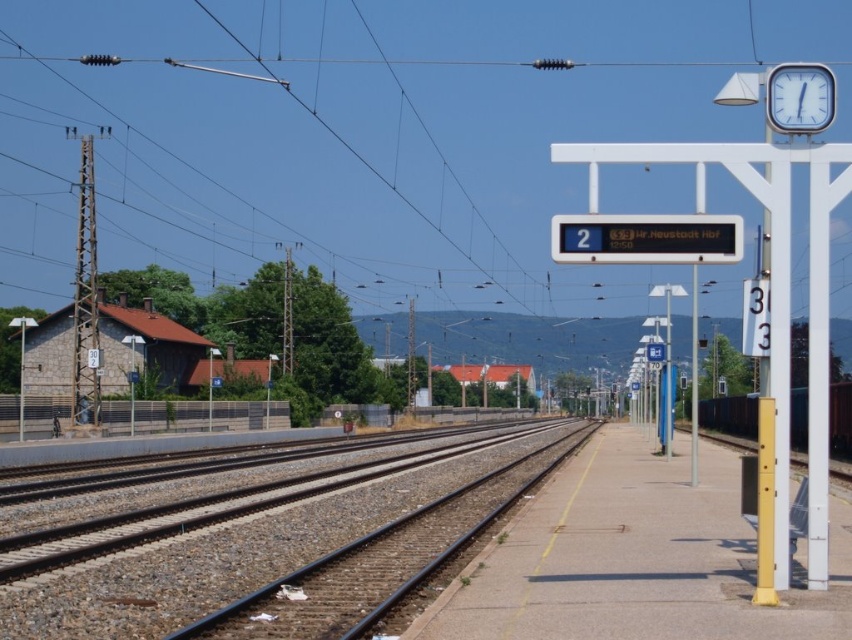
You are a railway engineer checking the platform dimensions. The metallic red train at right has a width of 3 meters. Can the concrete platform at center accommodate the train?

The concrete platform at center is narrower than the metallic red train at right, so it cannot fully accommodate the train. The platform must be widened to match or exceed the train width.

You are standing at the railway station platform described in the scene. There is a point marked at coordinates (x=632, y=560). What is located at this point?

The point at (x=632, y=560) is occupied by the concrete platform at center.

You are standing on the platform and want to walk from point (735, 410) to point (792, 120). Which direction should you move to get closer to your destination?

You should move towards the right because point (735, 410) is further to the viewer than point (792, 120), so moving right would take you closer to the destination.